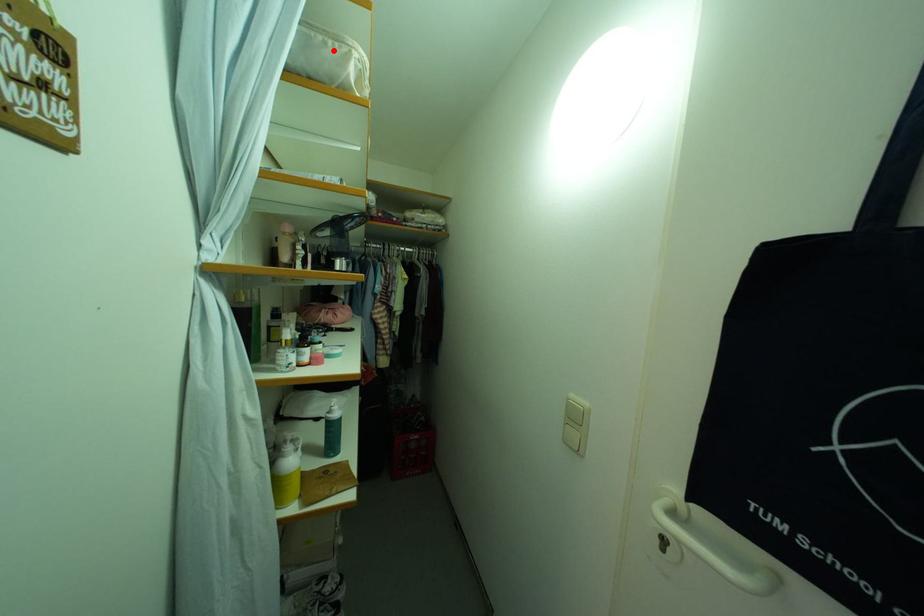
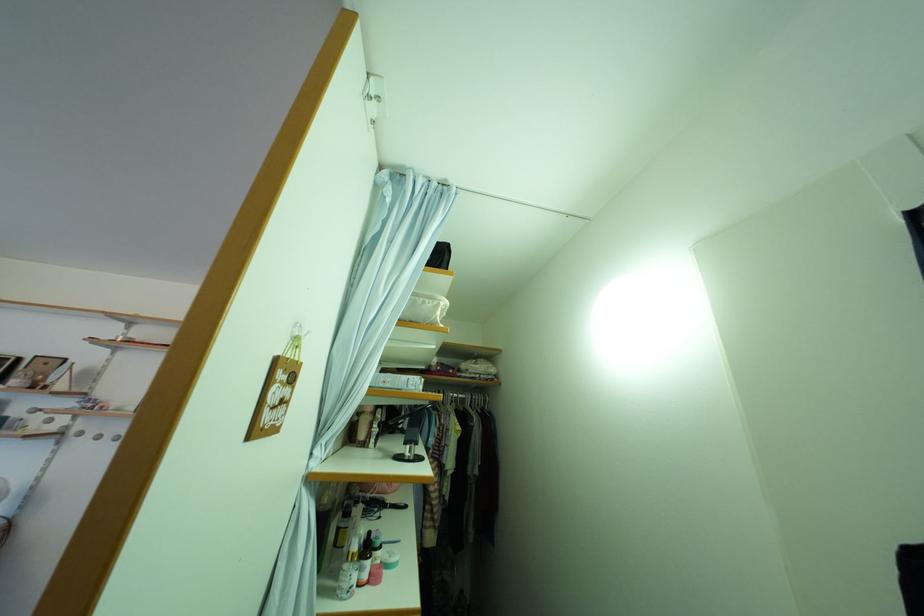
Where in the second image is the point corresponding to the highlighted location from the first image?

(432, 309)